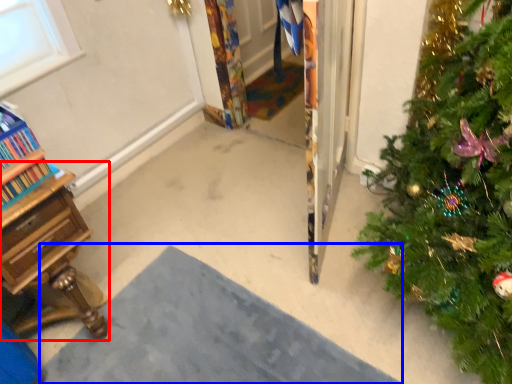
Question: Among these objects, which one is nearest to the camera, desk (highlighted by a red box) or doormat (highlighted by a blue box)?

Choices:
 (A) desk
 (B) doormat

Answer: (B)